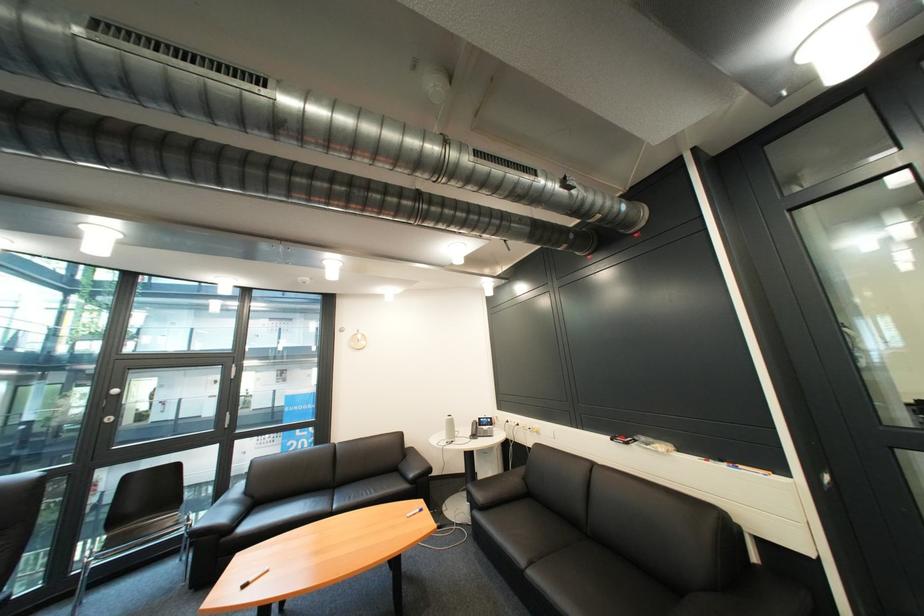
Identify the location of black and orange marker. This screenshot has height=616, width=924. (747, 469).